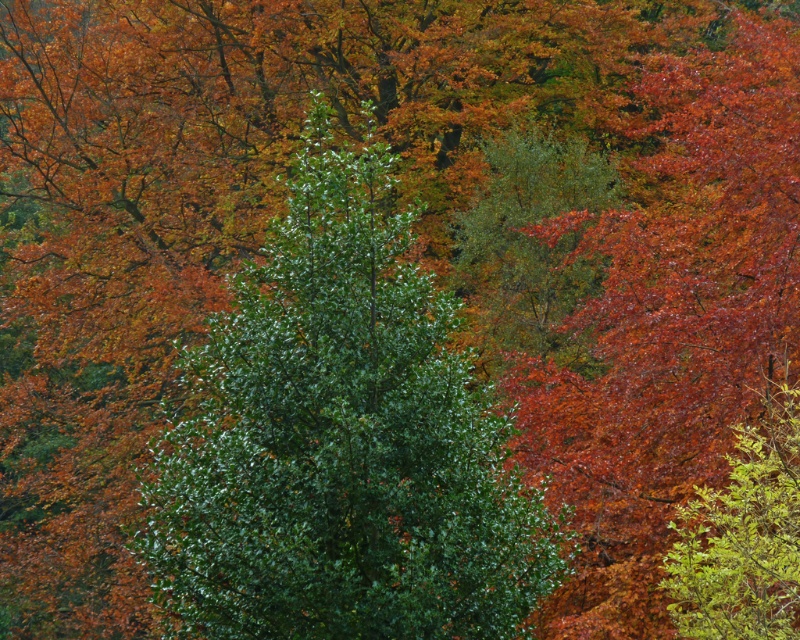
Looking at this image, is green glossy tree at center above green leafy shrub at right?

Incorrect, green glossy tree at center is not positioned above green leafy shrub at right.

Where is `green glossy tree at center`? The height and width of the screenshot is (640, 800). green glossy tree at center is located at coordinates (341, 442).

What are the coordinates of `green glossy tree at center` in the screenshot? It's located at (341, 442).